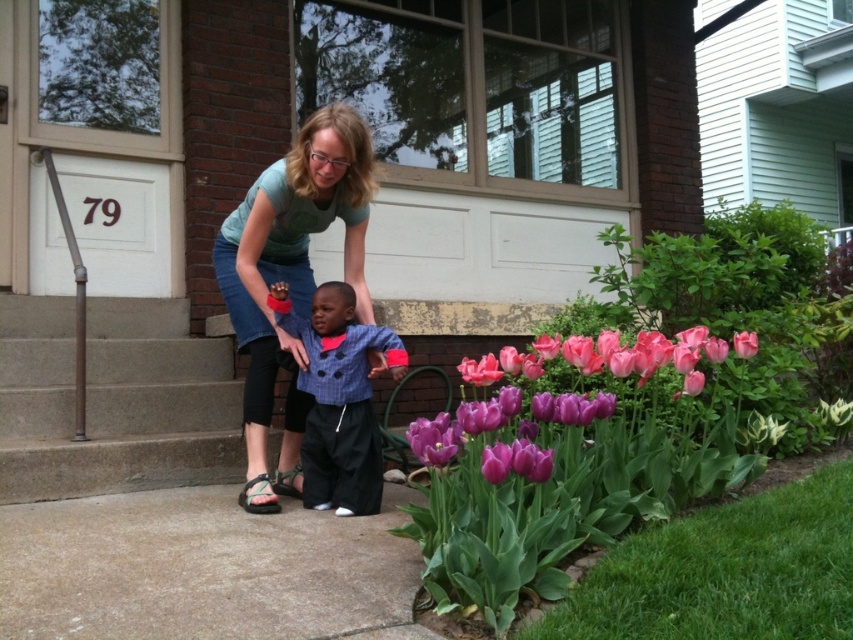
Question: Can you confirm if gray concrete pavement at lower center is positioned to the right of denim skirt at center?

Choices:
 (A) yes
 (B) no

Answer: (B)

Question: Which object is the farthest from the purple matte tulip at center?

Choices:
 (A) gray concrete pavement at lower center
 (B) pink glossy tulip at center

Answer: (A)

Question: Which object is farther from the camera taking this photo?

Choices:
 (A) gray concrete pavement at lower center
 (B) purple matte tulip at center
 (C) pink glossy tulip at center

Answer: (B)

Question: Does concrete at left have a larger size compared to denim skirt at center?

Choices:
 (A) no
 (B) yes

Answer: (A)

Question: Estimate the real-world distances between objects in this image. Which object is farther from the concrete at left?

Choices:
 (A) pink glossy tulip at center
 (B) denim skirt at center
 (C) gray concrete pavement at lower center
 (D) blue textured shirt at center

Answer: (A)

Question: Is concrete at left positioned in front of pink glossy tulip at center?

Choices:
 (A) yes
 (B) no

Answer: (B)